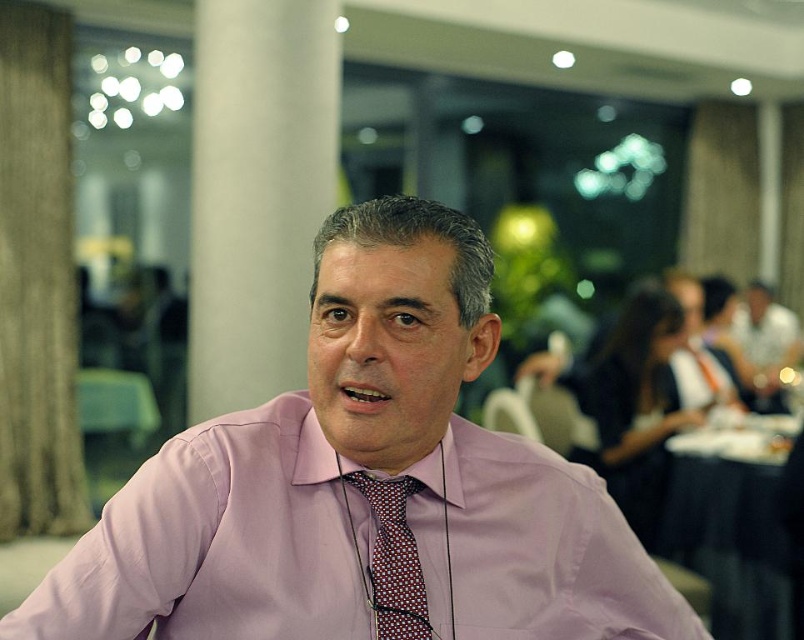
This screenshot has height=640, width=804. I want to click on pink fabric shirt at center, so click(367, 474).

Which is in front, point (353, 630) or point (772, 529)?

Positioned in front is point (353, 630).

This screenshot has width=804, height=640. Find the location of `pink fabric shirt at center`. pink fabric shirt at center is located at coordinates (367, 474).

Is point (277, 616) positioned behind point (413, 593)?

No, it is not.

Which is behind, point (51, 632) or point (396, 484)?

Point (396, 484)

Which is behind, point (252, 545) or point (396, 618)?

The point (396, 618) is more distant.

At what (x,y) coordinates should I click in order to perform the action: click on pink fabric shirt at center. Please return your answer as a coordinate pair (x, y). Image resolution: width=804 pixels, height=640 pixels. Looking at the image, I should click on (367, 474).

Who is higher up, black fabric table at lower right or red dotted tie at center?

red dotted tie at center is higher up.

This screenshot has width=804, height=640. I want to click on black fabric table at lower right, so click(731, 540).

Identify the location of black fabric table at lower right. (731, 540).